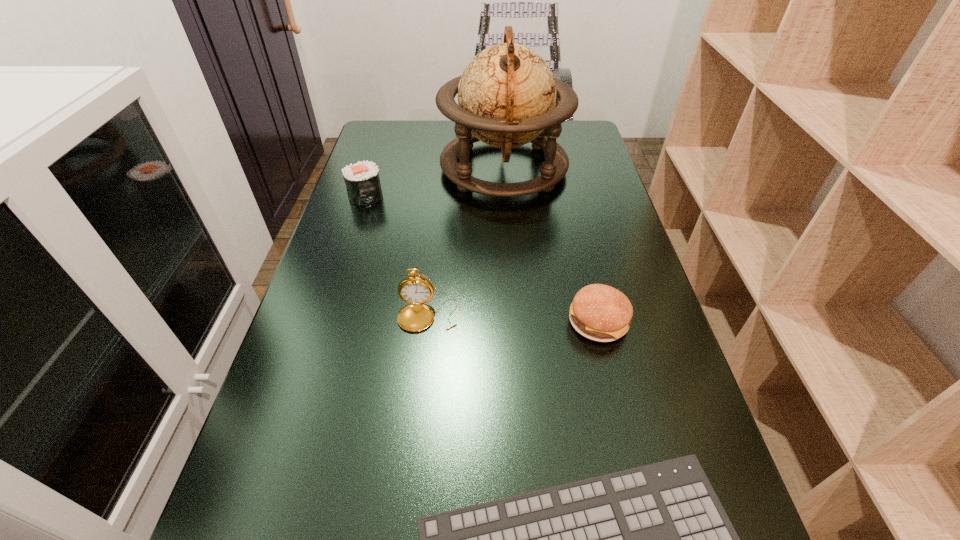
Where is `the tallest object`? The image size is (960, 540). the tallest object is located at coordinates (507, 93).

Identify the location of pocket watch. (415, 290).

You are a GUI agent. You are given a task and a screenshot of the screen. Output one action in this format:
    pyautogui.click(x=<x>, y=<y>)
    Task: Click on the sushi
    Image resolution: width=960 pixels, height=540 pixels.
    Given the screenshot: What is the action you would take?
    (362, 180)

Where is `the third tallest object`? the third tallest object is located at coordinates (362, 180).

You are a GUI agent. You are given a task and a screenshot of the screen. Output one action in this format:
    pyautogui.click(x=<x>, y=<y>)
    Task: Click on the second shortest object
    This screenshot has height=540, width=960.
    Given the screenshot: What is the action you would take?
    pyautogui.click(x=599, y=312)

Where is `vacant position located on the back of the tallest object`? vacant position located on the back of the tallest object is located at coordinates coord(500,122).

The height and width of the screenshot is (540, 960). In order to click on free space located 0.200m on the face of the pocket watch in this screenshot , I will do `click(416, 426)`.

Locate an element on the screen. This screenshot has width=960, height=540. vacant space positioned on the back of the leftmost object is located at coordinates (386, 132).

The width and height of the screenshot is (960, 540). I want to click on blank area located on the back of the hamburger, so click(584, 265).

This screenshot has width=960, height=540. I want to click on object that is at the far edge, so click(x=507, y=93).